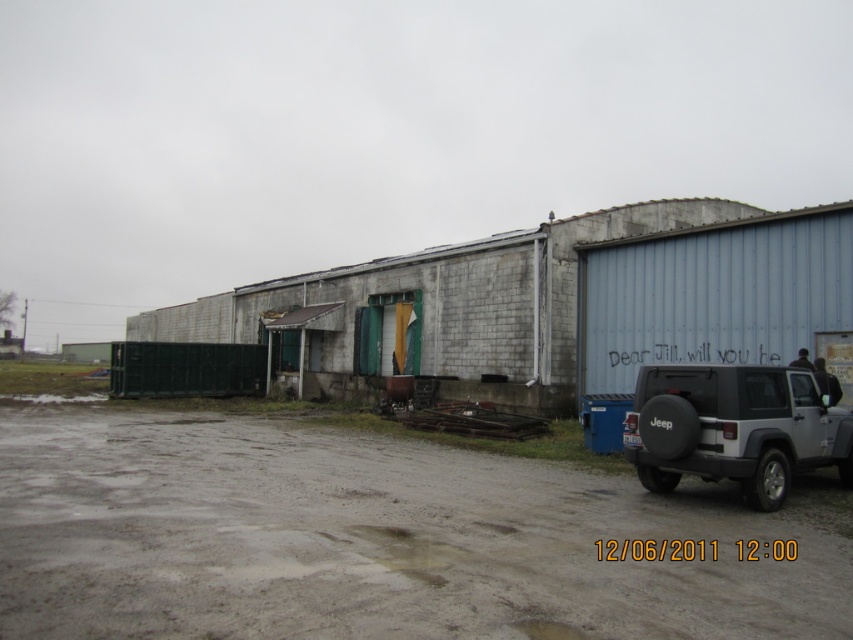
Can you confirm if gray dirt track at lower center is positioned below silver matte jeep at right?

Correct, gray dirt track at lower center is located below silver matte jeep at right.

Is point (368, 604) farther from viewer compared to point (654, 376)?

No, (368, 604) is closer to viewer.

At what (x,y) coordinates should I click in order to perform the action: click on gray dirt track at lower center. Please return your answer as a coordinate pair (x, y). The image size is (853, 640). Looking at the image, I should click on (368, 540).